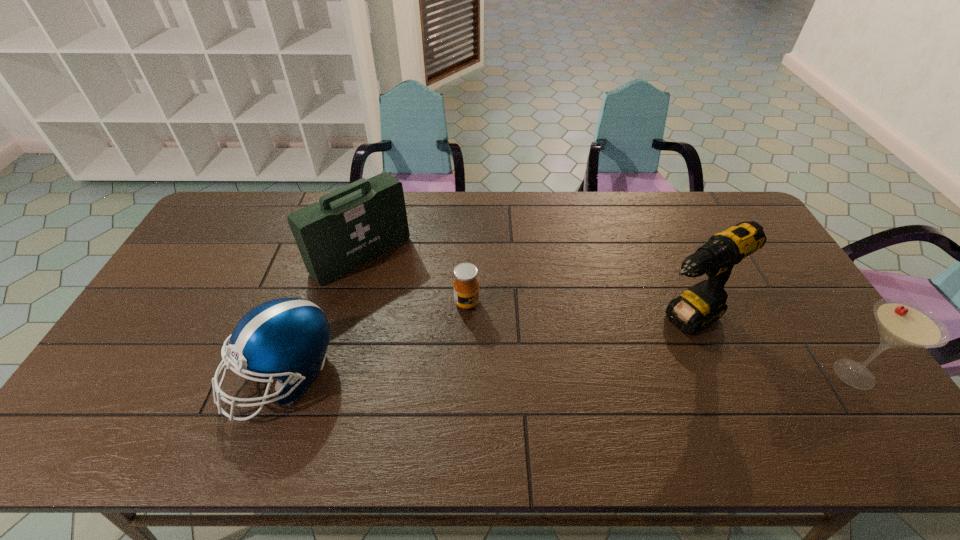
At what (x,y) coordinates should I click in order to perform the action: click on vacant space on the desktop that is between the football helmet and the rightmost object and is positioned on the front-facing side of the farthest object. Please return your answer as a coordinate pair (x, y). Looking at the image, I should click on (489, 375).

In order to click on free space on the desktop that is between the football helmet and the rightmost object and is positioned at the tip of the drill in this screenshot , I will do `click(601, 375)`.

Where is `vacant space on the desktop that is between the football helmet and the rightmost object and is positioned on the front-facing side of the shortest object`? The height and width of the screenshot is (540, 960). vacant space on the desktop that is between the football helmet and the rightmost object and is positioned on the front-facing side of the shortest object is located at coordinates (602, 375).